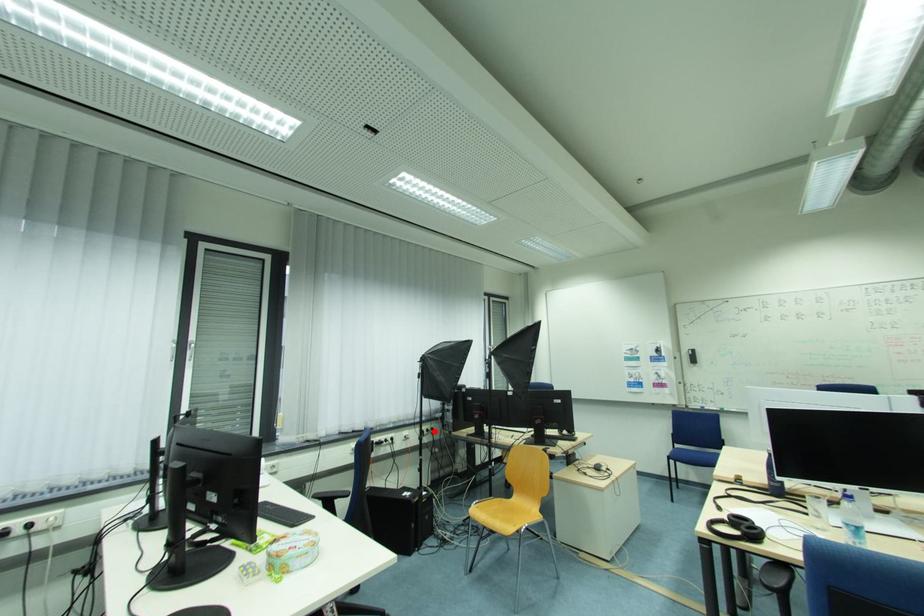
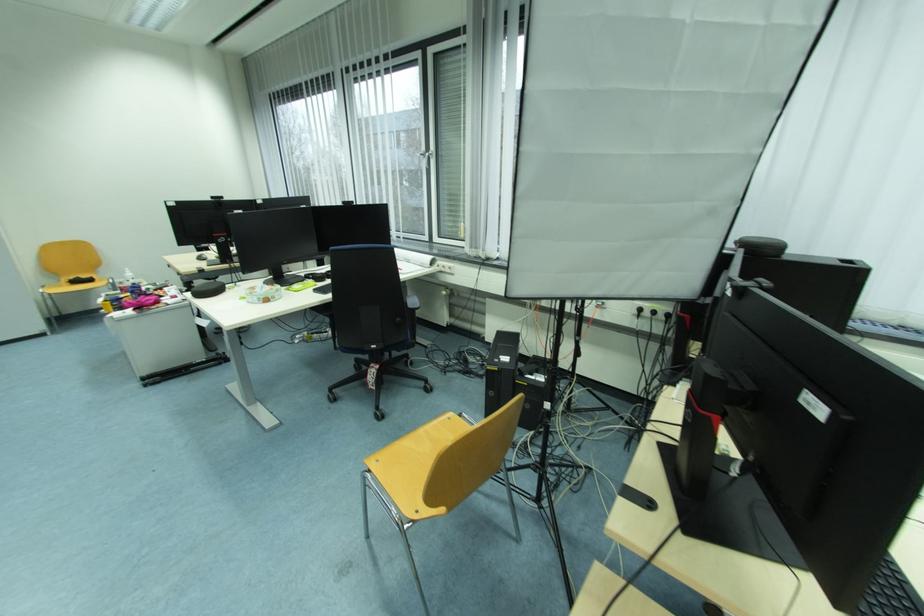
Question: I am providing you with two images of the same scene from different viewpoints. Given a red point in image1, look at the same physical point in image2. Is it:

Choices:
 (A) Closer to the viewpoint
 (B) Farther from the viewpoint

Answer: (A)